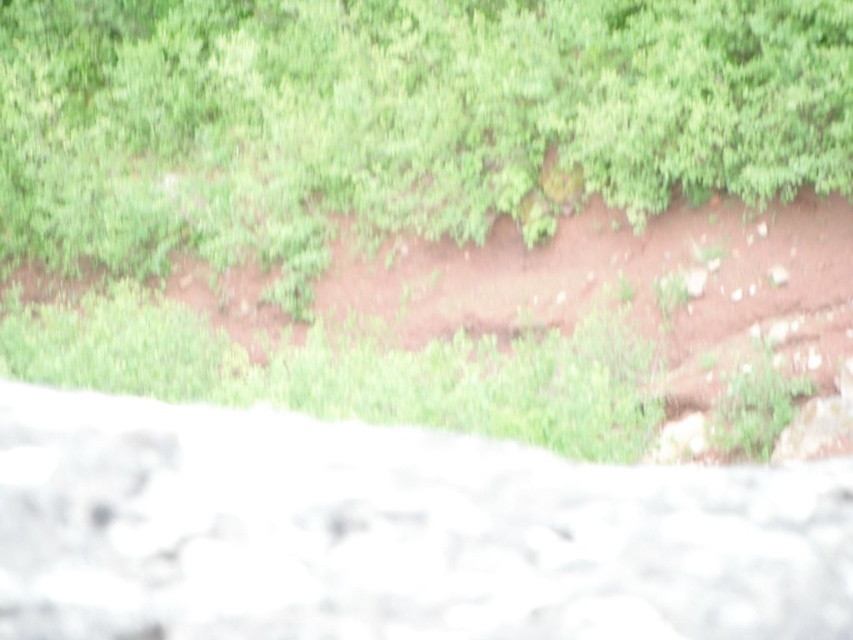
Question: In this image, where is green leafy vegetation at upper center located relative to white marble stone at center?

Choices:
 (A) right
 (B) left

Answer: (B)

Question: Which point is farther from the camera taking this photo?

Choices:
 (A) (793, 604)
 (B) (231, 90)
 (C) (840, 298)

Answer: (B)

Question: Is green leafy vegetation at upper center further to camera compared to white marble stone at center?

Choices:
 (A) yes
 (B) no

Answer: (A)

Question: Is green leafy vegetation at upper center smaller than white marble stone at center?

Choices:
 (A) yes
 (B) no

Answer: (B)

Question: Which object is positioned closest to the brown dirt track at center?

Choices:
 (A) white marble stone at center
 (B) green leafy vegetation at upper center

Answer: (B)

Question: Among these points, which one is nearest to the camera?

Choices:
 (A) (270, 182)
 (B) (0, 593)

Answer: (B)